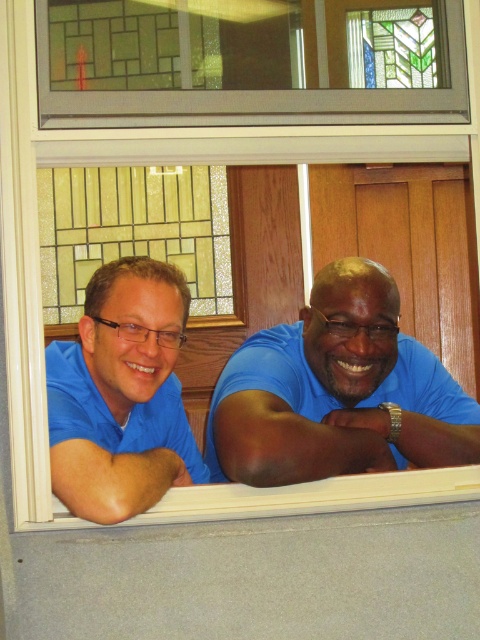
Can you confirm if blue matte shirt at center is smaller than blue matte shirt at left?

Incorrect, blue matte shirt at center is not smaller in size than blue matte shirt at left.

At what (x,y) coordinates should I click in order to perform the action: click on blue matte shirt at center. Please return your answer as a coordinate pair (x, y). This screenshot has width=480, height=640. Looking at the image, I should click on click(x=337, y=392).

Between point (279, 396) and point (87, 515), which one is positioned behind?

Positioned behind is point (279, 396).

The image size is (480, 640). In order to click on blue matte shirt at center in this screenshot , I will do `click(337, 392)`.

Does blue matte shirt at left have a smaller size compared to white wood window sill at lower center?

No, blue matte shirt at left is not smaller than white wood window sill at lower center.

You are a GUI agent. You are given a task and a screenshot of the screen. Output one action in this format:
    pyautogui.click(x=<x>, y=<y>)
    Task: Click on the blue matte shirt at left
    
    Given the screenshot: What is the action you would take?
    pyautogui.click(x=121, y=396)

Who is more distant from viewer, (181, 77) or (72, 508)?

The point (181, 77) is more distant.

Is stained glass window at upper center closer to the viewer compared to blue matte shirt at left?

No, stained glass window at upper center is further to the viewer.

Which is behind, point (87, 68) or point (96, 480)?

Point (87, 68)

The height and width of the screenshot is (640, 480). In order to click on stained glass window at upper center in this screenshot , I will do `click(232, 65)`.